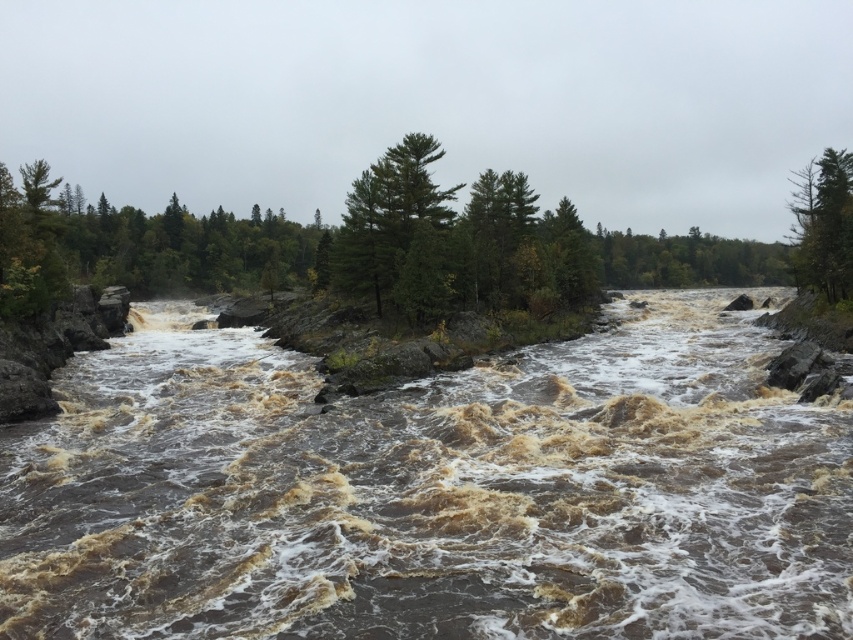
Who is lower down, green matte tree at left or green matte tree at center?

Positioned lower is green matte tree at center.

Which of these two, green matte tree at left or green matte tree at center, stands taller?

green matte tree at left is taller.

Who is more distant from viewer, (x=172, y=268) or (x=439, y=193)?

The point (x=172, y=268) is behind.

This screenshot has height=640, width=853. What are the coordinates of `green matte tree at left` in the screenshot? It's located at (138, 244).

Who is positioned more to the right, green matte tree at left or green leafy trees at center?

green leafy trees at center is more to the right.

Find the location of `green matte tree at left`. green matte tree at left is located at coordinates (138, 244).

Locate an element on the screen. The height and width of the screenshot is (640, 853). green matte tree at left is located at coordinates (138, 244).

Is brown muddy water at center thinner than green leafy trees at center?

Yes.

Does brown muddy water at center have a lesser height compared to green leafy trees at center?

Correct, brown muddy water at center is not as tall as green leafy trees at center.

What do you see at coordinates (432, 493) in the screenshot? I see `brown muddy water at center` at bounding box center [432, 493].

Where is `brown muddy water at center`? brown muddy water at center is located at coordinates (432, 493).